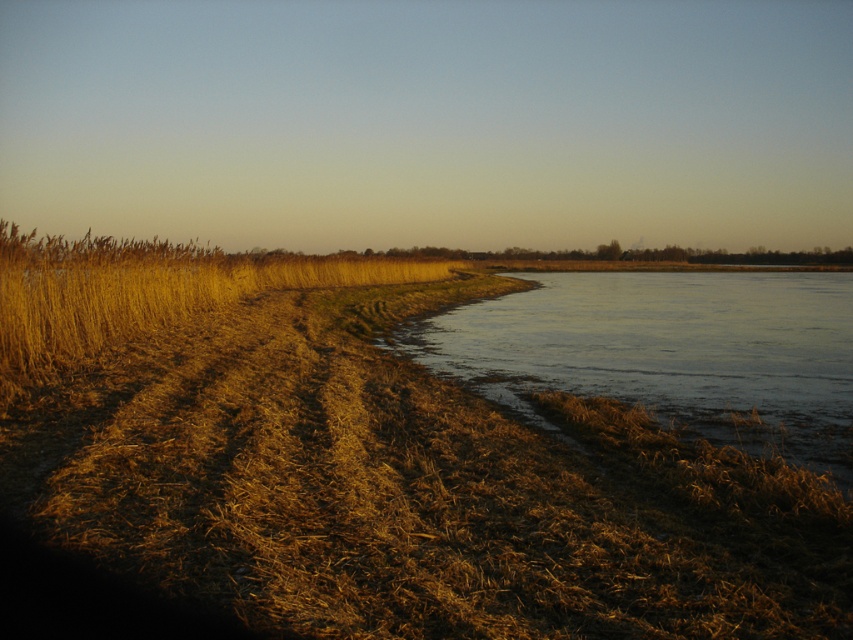
Question: Does dry grass at left lie behind frozen ice at lower right?

Choices:
 (A) yes
 (B) no

Answer: (B)

Question: Which point appears farthest from the camera in this image?

Choices:
 (A) (759, 401)
 (B) (264, 289)

Answer: (B)

Question: Which object appears farthest from the camera in this image?

Choices:
 (A) dry grass at left
 (B) frozen ice at lower right

Answer: (B)

Question: Does dry grass at left have a lesser width compared to frozen ice at lower right?

Choices:
 (A) no
 (B) yes

Answer: (B)

Question: Is dry grass at left behind golden dry grass at left?

Choices:
 (A) yes
 (B) no

Answer: (B)

Question: Which is nearer to the golden dry grass at left?

Choices:
 (A) frozen ice at lower right
 (B) dry grass at left

Answer: (B)